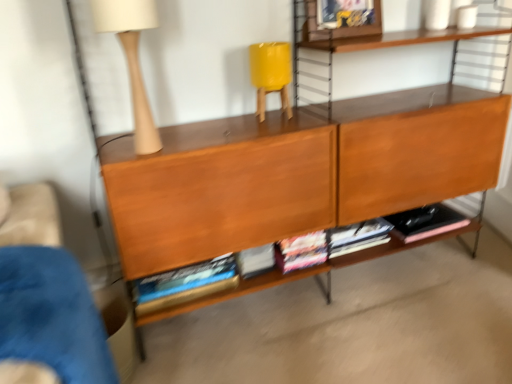
Question: Looking at the image, does matte beige table lamp at upper left seem bigger or smaller compared to blue fabric armchair at lower left?

Choices:
 (A) small
 (B) big

Answer: (A)

Question: Considering the positions of point (144, 112) and point (57, 340), is point (144, 112) closer or farther from the camera than point (57, 340)?

Choices:
 (A) farther
 (B) closer

Answer: (A)

Question: Based on their relative distances, which object is nearer to the matte beige table lamp at upper left?

Choices:
 (A) blue fabric armchair at lower left
 (B) hardcover books at center
 (C) brown wood shelf at center

Answer: (C)

Question: Which is farther from the blue fabric armchair at lower left?

Choices:
 (A) hardcover books at center
 (B) brown wood shelf at center
 (C) matte beige table lamp at upper left

Answer: (A)